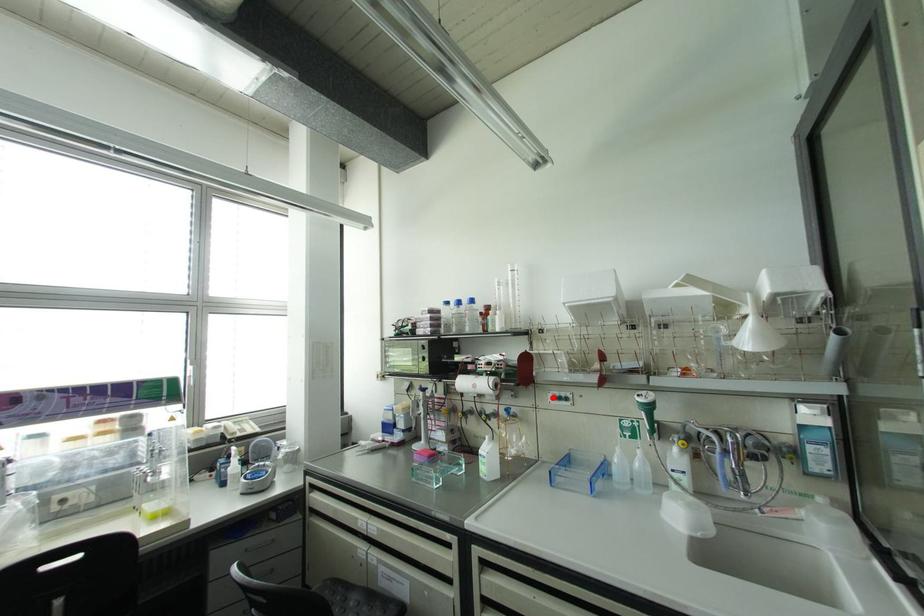
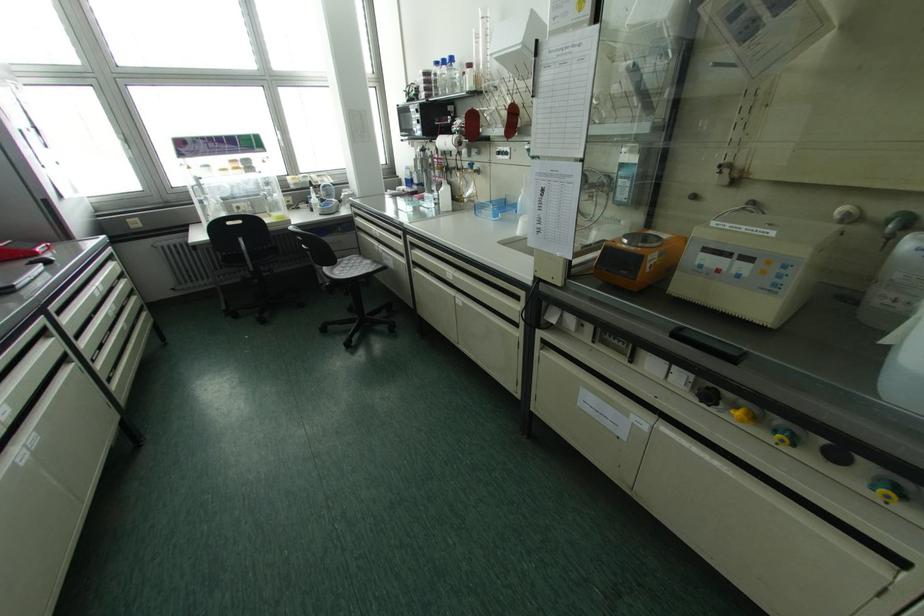
Locate, in the second image, the point that corresponds to the highlighted location in the first image.

(497, 153)